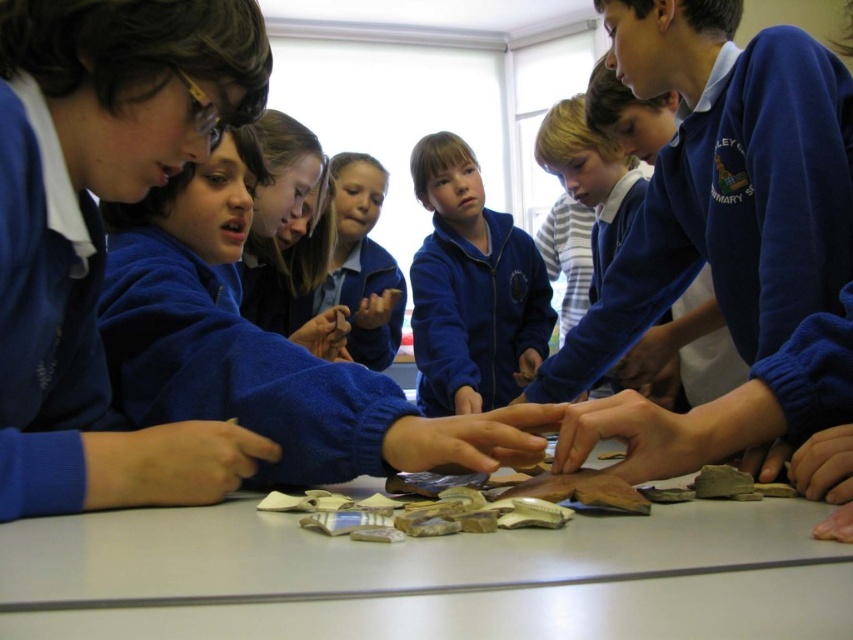
Is matte blue jacket at center thinner than matte blue uniform at center?

In fact, matte blue jacket at center might be wider than matte blue uniform at center.

Is point (434, 166) less distant than point (355, 278)?

Yes, it is.

Who is more forward, (445, 150) or (364, 317)?

Point (364, 317) is in front.

Where is `matte blue jacket at center`? matte blue jacket at center is located at coordinates (471, 289).

Who is more distant from viewer, (607, 241) or (332, 304)?

Point (332, 304)

Which is in front, point (622, 374) or point (352, 237)?

Point (622, 374) is more forward.

Who is more forward, [614,209] or [370,193]?

Point [614,209] is in front.

Where is `blue uniform shirt at upper right`? This screenshot has height=640, width=853. blue uniform shirt at upper right is located at coordinates (590, 179).

Does matte blue jacket at center lie in front of blue uniform shirt at upper right?

That is False.

Which is in front, point (482, 237) or point (596, 132)?

Point (596, 132) is in front.

Where is `matte blue jacket at center`? matte blue jacket at center is located at coordinates 471,289.